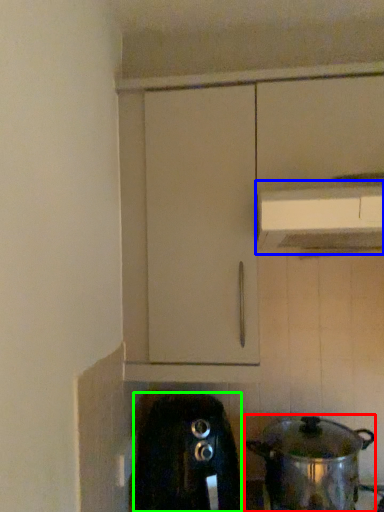
Question: Based on their relative distances, which object is farther from kitchen appliance (highlighted by a red box)? Choose from vent (highlighted by a blue box) and home appliance (highlighted by a green box).

Choices:
 (A) vent
 (B) home appliance

Answer: (A)